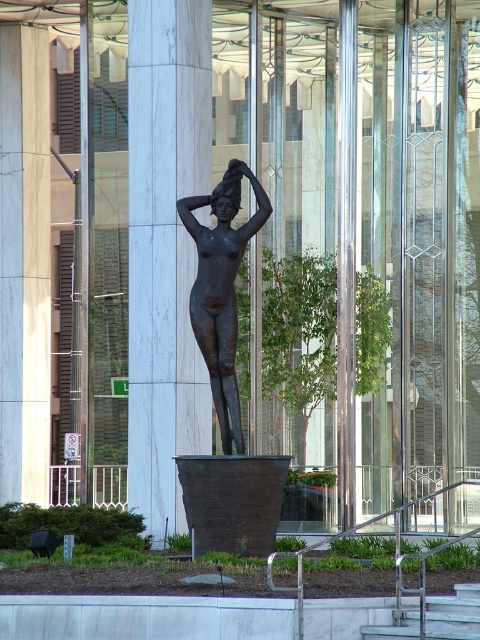
Is point (191, 1) less distant than point (212, 278)?

No, it is not.

Is matte white column at center below bronze statue at center?

No, matte white column at center is not below bronze statue at center.

Who is more distant from viewer, (135, 84) or (210, 260)?

Point (135, 84)

Identify the location of matte white column at center. The image size is (480, 640). (165, 248).

Who is more forward, (222, 332) or (410, 634)?

Point (410, 634) is in front.

Does bronze statue at center have a lesser height compared to metallic gray stairs at lower center?

No.

Does point (203, 330) come closer to viewer compared to point (442, 600)?

No, it is behind (442, 600).

What are the coordinates of `bronze statue at center` in the screenshot? It's located at (222, 289).

Can you confirm if matte white column at center is positioned below metallic gray stairs at lower center?

No.

Does point (184, 83) lie behind point (407, 637)?

Yes, point (184, 83) is farther from viewer.

What do you see at coordinates (165, 248) in the screenshot? This screenshot has height=640, width=480. I see `matte white column at center` at bounding box center [165, 248].

This screenshot has width=480, height=640. Find the location of `matte white column at center`. matte white column at center is located at coordinates (165, 248).